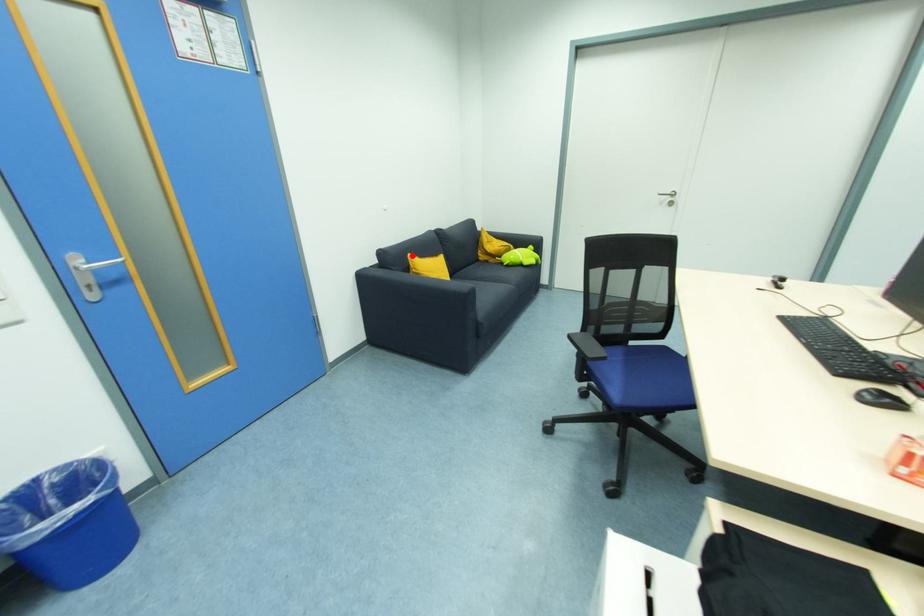
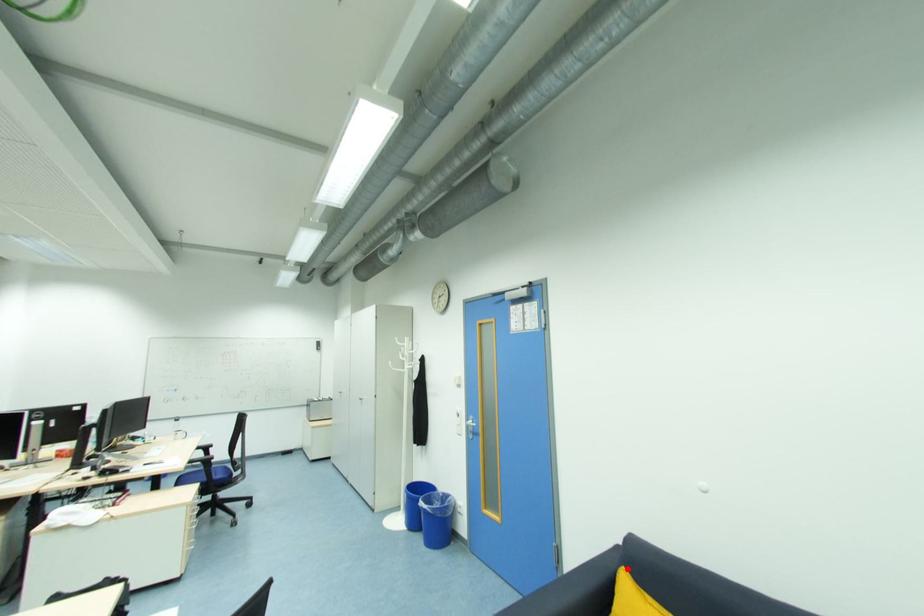
I am providing you with two images of the same scene from different viewpoints. A red point is marked on the first image and another point is marked on the second image. Does the point marked in image1 correspond to the same location as the one in image2?

Yes